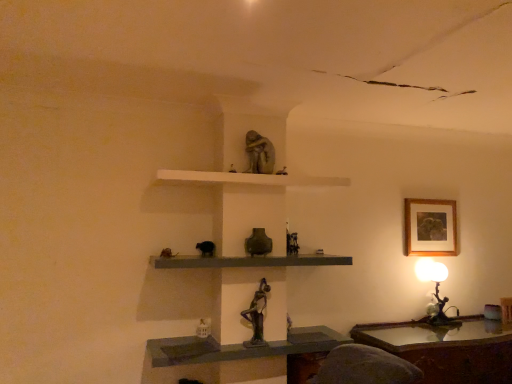
You are a GUI agent. You are given a task and a screenshot of the screen. Output one action in this format:
    pyautogui.click(x=<x>, y=<y>)
    Task: Click on the vacant space in matte gray stone statue at upper center, placed as the 2th sculpture when sorted from bottom to top (from a real-world perspective)
    This screenshot has width=512, height=384.
    Given the screenshot: What is the action you would take?
    pyautogui.click(x=260, y=173)